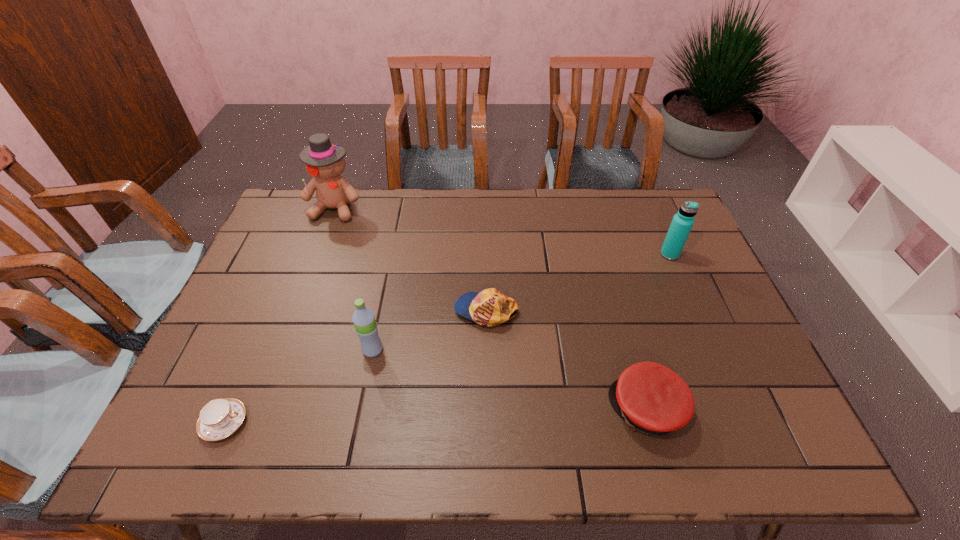
This screenshot has width=960, height=540. In order to click on free space between the nearer cap and the third farthest object in this screenshot , I will do `click(566, 360)`.

Where is `free space between the shortest object and the rag_doll`? The image size is (960, 540). free space between the shortest object and the rag_doll is located at coordinates pos(279,315).

You are a GUI agent. You are given a task and a screenshot of the screen. Output one action in this format:
    pyautogui.click(x=<x>, y=<y>)
    Task: Click on the unoccupied area between the fourth object from right to left and the third object from right to left
    The height and width of the screenshot is (540, 960).
    Given the screenshot: What is the action you would take?
    pyautogui.click(x=430, y=330)

At what (x,y) coordinates should I click in order to perform the action: click on empty space between the farthest object and the teacup. Please return your answer as a coordinate pair (x, y). Looking at the image, I should click on pos(279,315).

This screenshot has height=540, width=960. Identify the location of the fifth closest object to the right water bottle. (219, 418).

Identify which object is the fifth closest to the third object from left to right. Please provide its 2D coordinates. Your answer should be formatted as a tuple, i.e. [(x, y)], where the tuple contains the x and y coordinates of a point satisfying the conditions above.

[(682, 222)]

The height and width of the screenshot is (540, 960). In order to click on vacant area in the image that satisfies the following two spatial constraints: 1. on the front side of the left water bottle; 2. on the side with the handle of the shortest object in this screenshot , I will do `click(358, 423)`.

Find the location of `vacant space that satisfies the following two spatial constraints: 1. on the front-facing side of the fifth nearest object; 2. on the right side of the farthest object`. vacant space that satisfies the following two spatial constraints: 1. on the front-facing side of the fifth nearest object; 2. on the right side of the farthest object is located at coordinates (318, 254).

Identify the location of blank space that satisfies the following two spatial constraints: 1. on the front side of the rightmost object; 2. on the bill of the third object from right to left. (694, 310).